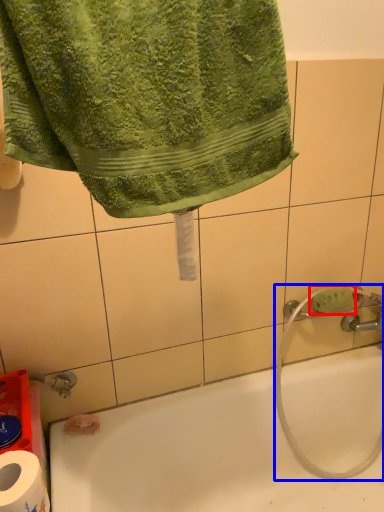
Question: Which of the following is the closest to the observer, soap (highlighted by a red box) or garden hose (highlighted by a blue box)?

Choices:
 (A) soap
 (B) garden hose

Answer: (B)